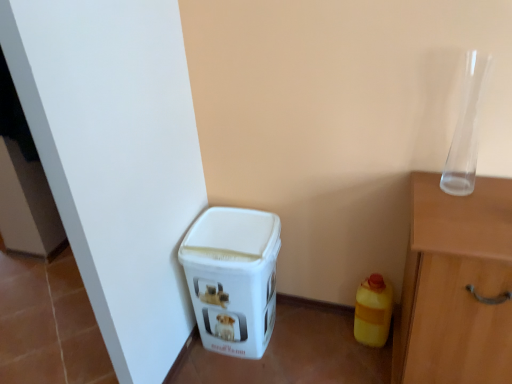
Measure the distance between transparent glass vase at upper right and camera.

A distance of 1.31 meters exists between transparent glass vase at upper right and camera.

The image size is (512, 384). Identify the location of yellow matte plastic bottle at lower right. (x=373, y=311).

Find the location of a particular element. The width and height of the screenshot is (512, 384). white plastic bin at lower left is located at coordinates tap(233, 278).

Considering the sizes of objects transparent glass vase at upper right and yellow matte plastic bottle at lower right in the image provided, who is wider, transparent glass vase at upper right or yellow matte plastic bottle at lower right?

yellow matte plastic bottle at lower right is wider.

Between transparent glass vase at upper right and yellow matte plastic bottle at lower right, which one has larger size?

Bigger between the two is yellow matte plastic bottle at lower right.

Between transparent glass vase at upper right and yellow matte plastic bottle at lower right, which one has more height?

Standing taller between the two is transparent glass vase at upper right.

Looking at their sizes, would you say yellow matte plastic bottle at lower right is wider or thinner than white plastic bin at lower left?

In the image, yellow matte plastic bottle at lower right appears to be more narrow than white plastic bin at lower left.

From a real-world perspective, is yellow matte plastic bottle at lower right physically below white plastic bin at lower left?

Correct, in the physical world, yellow matte plastic bottle at lower right is lower than white plastic bin at lower left.

Which object is closer to the camera, yellow matte plastic bottle at lower right or white plastic bin at lower left?

white plastic bin at lower left is closer to the camera.

Looking at this image, from the image's perspective, between yellow matte plastic bottle at lower right and white plastic bin at lower left, who is located below?

yellow matte plastic bottle at lower right, from the image's perspective.

Can you confirm if yellow matte plastic bottle at lower right is taller than transparent glass vase at upper right?

In fact, yellow matte plastic bottle at lower right may be shorter than transparent glass vase at upper right.

Is yellow matte plastic bottle at lower right behind transparent glass vase at upper right?

Yes, yellow matte plastic bottle at lower right is further from the viewer.

From the image's perspective, is yellow matte plastic bottle at lower right located above or below transparent glass vase at upper right?

yellow matte plastic bottle at lower right is below transparent glass vase at upper right.

Can you confirm if yellow matte plastic bottle at lower right is wider than transparent glass vase at upper right?

Yes, yellow matte plastic bottle at lower right is wider than transparent glass vase at upper right.

From the image's perspective, which one is positioned lower, transparent glass vase at upper right or white plastic bin at lower left?

white plastic bin at lower left is shown below in the image.

From a real-world perspective, is transparent glass vase at upper right physically above white plastic bin at lower left?

Yes, from a real-world perspective, transparent glass vase at upper right is above white plastic bin at lower left.

Can we say transparent glass vase at upper right lies outside white plastic bin at lower left?

Absolutely, transparent glass vase at upper right is external to white plastic bin at lower left.

Find the location of a particular element. The height and width of the screenshot is (384, 512). glass vase positioned vertically above the white plastic bin at lower left (from a real-world perspective) is located at coordinates (466, 128).

Considering the sizes of objects white plastic bin at lower left and yellow matte plastic bottle at lower right in the image provided, who is smaller, white plastic bin at lower left or yellow matte plastic bottle at lower right?

Smaller between the two is yellow matte plastic bottle at lower right.

Does white plastic bin at lower left lie in front of yellow matte plastic bottle at lower right?

Yes, white plastic bin at lower left is in front of yellow matte plastic bottle at lower right.

Could yellow matte plastic bottle at lower right be considered to be inside white plastic bin at lower left?

No, yellow matte plastic bottle at lower right is not surrounded by white plastic bin at lower left.

The height and width of the screenshot is (384, 512). I want to click on waste container above the yellow matte plastic bottle at lower right (from a real-world perspective), so click(233, 278).

Who is smaller, white plastic bin at lower left or transparent glass vase at upper right?

With smaller size is transparent glass vase at upper right.

Does white plastic bin at lower left turn towards transparent glass vase at upper right?

No, white plastic bin at lower left does not turn towards transparent glass vase at upper right.

Who is more distant, white plastic bin at lower left or transparent glass vase at upper right?

white plastic bin at lower left.

This screenshot has width=512, height=384. I want to click on bottle that is under the transparent glass vase at upper right (from a real-world perspective), so click(373, 311).

The height and width of the screenshot is (384, 512). I want to click on waste container above the yellow matte plastic bottle at lower right (from a real-world perspective), so click(x=233, y=278).

Estimate the real-world distances between objects in this image. Which object is further from yellow matte plastic bottle at lower right, white plastic bin at lower left or transparent glass vase at upper right?

transparent glass vase at upper right is further to yellow matte plastic bottle at lower right.

Which object lies further to the anchor point transparent glass vase at upper right, white plastic bin at lower left or yellow matte plastic bottle at lower right?

white plastic bin at lower left lies further to transparent glass vase at upper right than the other object.

Considering their positions, is transparent glass vase at upper right positioned further to white plastic bin at lower left than yellow matte plastic bottle at lower right?

The object further to white plastic bin at lower left is transparent glass vase at upper right.

Estimate the real-world distances between objects in this image. Which object is closer to transparent glass vase at upper right, yellow matte plastic bottle at lower right or white plastic bin at lower left?

yellow matte plastic bottle at lower right.

Estimate the real-world distances between objects in this image. Which object is closer to yellow matte plastic bottle at lower right, transparent glass vase at upper right or white plastic bin at lower left?

white plastic bin at lower left.

Considering their positions, is yellow matte plastic bottle at lower right positioned further to white plastic bin at lower left than transparent glass vase at upper right?

Among the two, transparent glass vase at upper right is located further to white plastic bin at lower left.

This screenshot has height=384, width=512. I want to click on bottle between white plastic bin at lower left and transparent glass vase at upper right from left to right, so click(x=373, y=311).